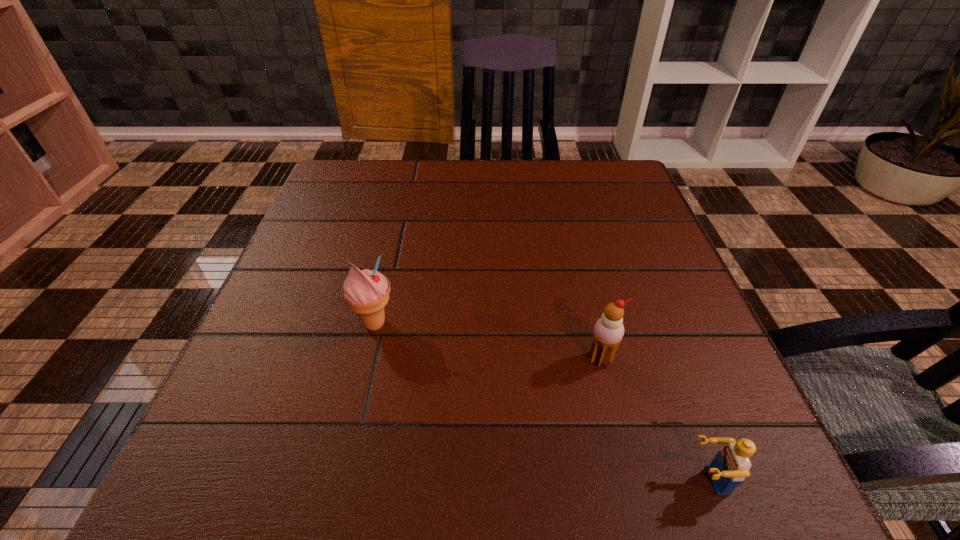
Where is `vacant area between the leftmost object and the nearer icecream`? This screenshot has width=960, height=540. vacant area between the leftmost object and the nearer icecream is located at coordinates (488, 341).

At what (x,y) coordinates should I click in order to perform the action: click on unoccupied position between the nearest object and the farther icecream. Please return your answer as a coordinate pair (x, y). Looking at the image, I should click on (540, 402).

In order to click on free space between the second nearest object and the left icecream in this screenshot , I will do `click(488, 341)`.

Locate an element on the screen. free space between the second object from left to right and the Lego is located at coordinates (654, 420).

Locate an element on the screen. vacant area that lies between the right icecream and the farthest object is located at coordinates (488, 341).

Locate an element on the screen. The image size is (960, 540). free point between the Lego and the farthest object is located at coordinates pos(540,402).

The height and width of the screenshot is (540, 960). In order to click on empty space between the second object from right to left and the Lego in this screenshot , I will do `click(654, 420)`.

Find the location of a particular element. Image resolution: width=960 pixels, height=540 pixels. free space that is in between the shortest object and the left icecream is located at coordinates (540, 402).

Find the location of a particular element. Image resolution: width=960 pixels, height=540 pixels. vacant area that lies between the left icecream and the shortest object is located at coordinates (540, 402).

Choose which object is the nearest neighbor to the farther icecream. Please provide its 2D coordinates. Your answer should be formatted as a tuple, i.e. [(x, y)], where the tuple contains the x and y coordinates of a point satisfying the conditions above.

[(608, 332)]